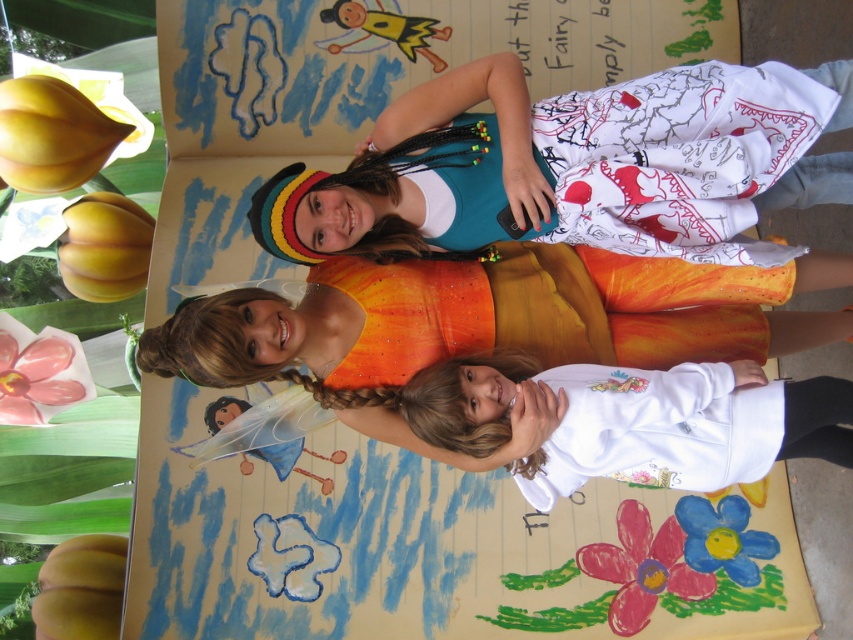
Question: Is white printed dress at center bigger than pink glossy flower at upper left?

Choices:
 (A) yes
 (B) no

Answer: (A)

Question: Is pastel pink paper flower at center positioned in front of blue painted flower at center?

Choices:
 (A) no
 (B) yes

Answer: (B)

Question: Estimate the real-world distances between objects in this image. Which object is farther from the blue painted flower at center?

Choices:
 (A) white printed dress at center
 (B) pastel pink paper flower at center

Answer: (A)

Question: Considering the real-world distances, which object is closest to the pastel pink paper flower at center?

Choices:
 (A) white fleece sweatshirt at center
 (B) pink glossy flower at upper left

Answer: (A)

Question: Which of the following is the farthest from the observer?

Choices:
 (A) pink glossy flower at upper left
 (B) pastel pink paper flower at center
 (C) white fleece sweatshirt at center
 (D) shiny orange fabric dress at center

Answer: (A)

Question: Can you confirm if shiny orange fabric dress at center is wider than white fleece sweatshirt at center?

Choices:
 (A) no
 (B) yes

Answer: (A)